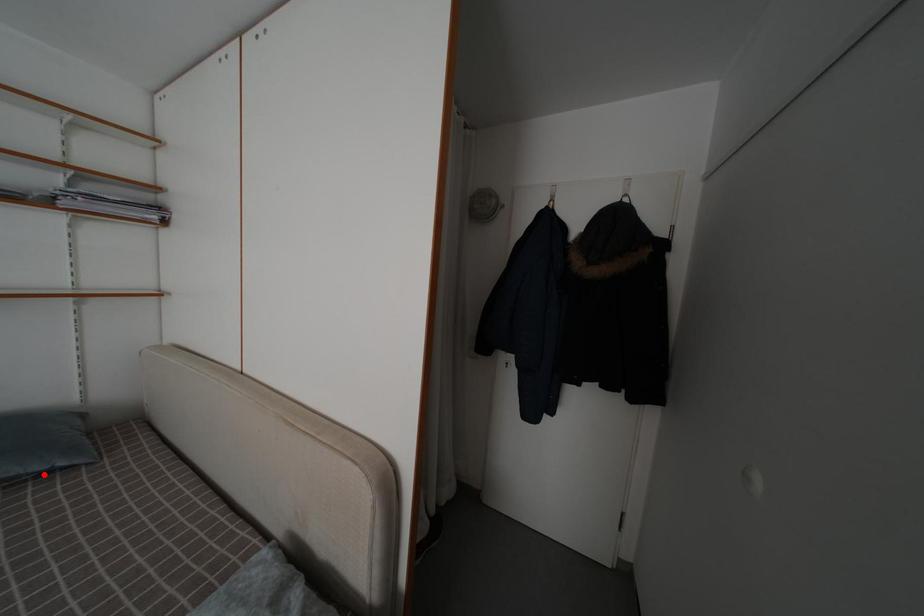
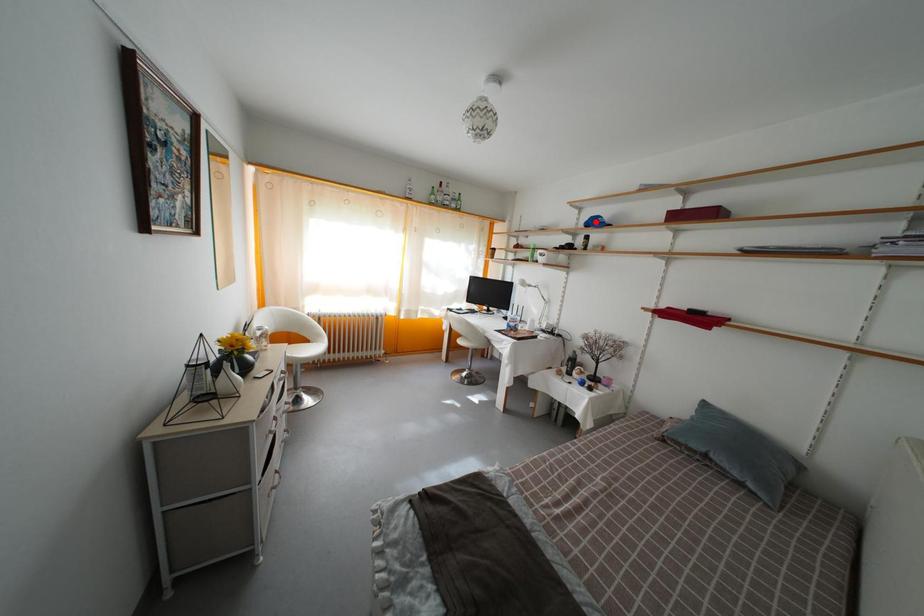
I am providing you with two images of the same scene from different viewpoints. A red point is marked on the first image and another point is marked on the second image. Does the point marked in image1 correspond to the same location as the one in image2?

No